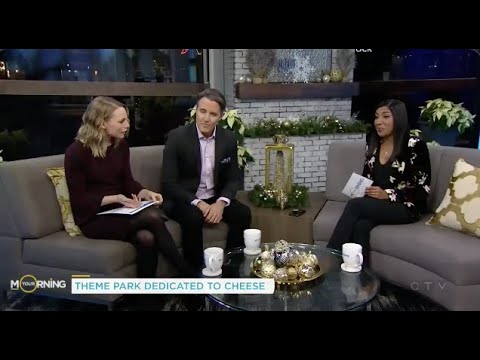
Find the location of `tabletop`. tabletop is located at coordinates point(320,294).